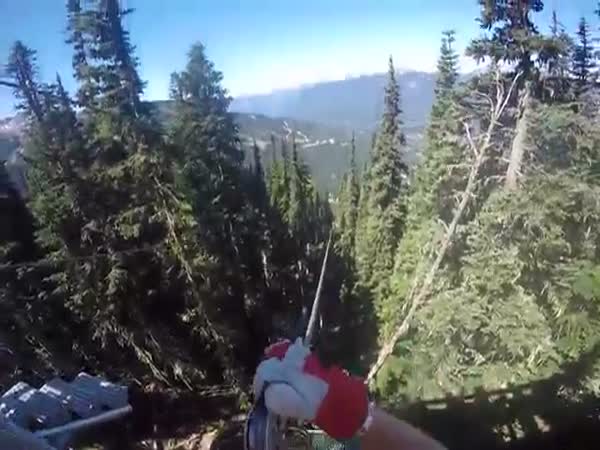
Locate an element on the screen. The height and width of the screenshot is (450, 600). brown tree floor is located at coordinates (178, 432), (208, 400).